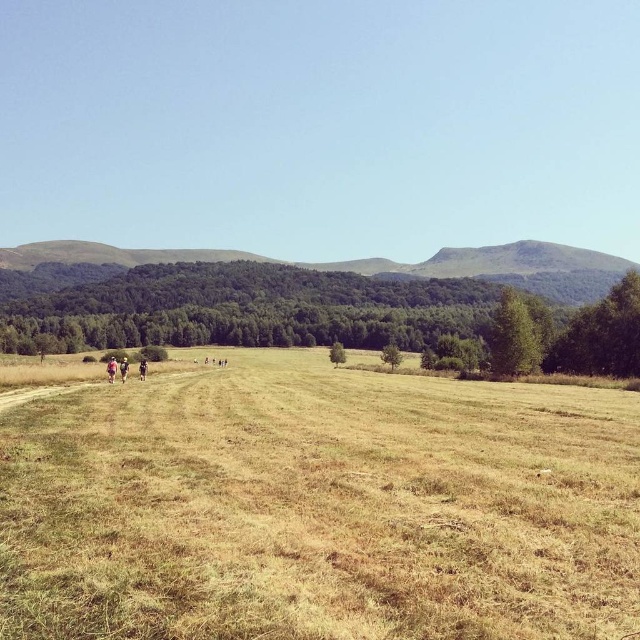
Can you confirm if light brown fabric jacket at left is positioned below light blue fabric at left?

Indeed, light brown fabric jacket at left is positioned under light blue fabric at left.

The height and width of the screenshot is (640, 640). Identify the location of light brown fabric jacket at left. (112, 369).

Locate an element on the screen. light brown fabric jacket at left is located at coordinates (112, 369).

Looking at this image, is the position of brown grassy field at center more distant than that of light blue fabric at left?

No, brown grassy field at center is in front of light blue fabric at left.

Which is in front, point (218, 628) or point (125, 369)?

Positioned in front is point (218, 628).

I want to click on brown grassy field at center, so click(x=320, y=508).

Between light brown fabric jacket at left and light brown leather jacket at center, which one is positioned higher?

Positioned higher is light brown leather jacket at center.

Which is more to the right, light brown fabric jacket at left or light brown leather jacket at center?

Positioned to the right is light brown leather jacket at center.

The height and width of the screenshot is (640, 640). Find the location of `light brown fabric jacket at left`. light brown fabric jacket at left is located at coordinates (112, 369).

At what (x,y) coordinates should I click in order to perform the action: click on light brown fabric jacket at left. Please return your answer as a coordinate pair (x, y). The width and height of the screenshot is (640, 640). Looking at the image, I should click on (112, 369).